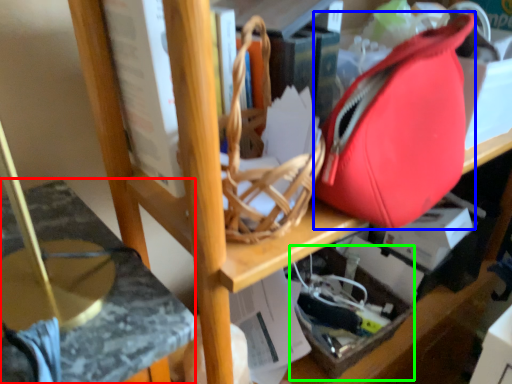
Question: Estimate the real-world distances between objects in this image. Which object is closer to swivel chair (highlighted by a red box), tote bag (highlighted by a blue box) or box (highlighted by a green box)?

Choices:
 (A) tote bag
 (B) box

Answer: (A)